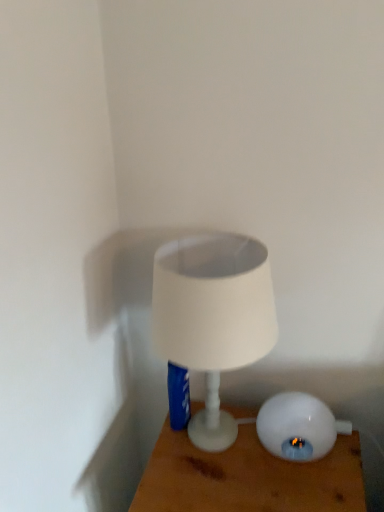
Question: Can you confirm if white matte lampshade at center, acting as the first lamp starting from the left, is taller than white glossy lamp at lower right, the second lamp from the left?

Choices:
 (A) no
 (B) yes

Answer: (B)

Question: Can you confirm if white matte lampshade at center, acting as the first lamp starting from the left, is wider than white glossy lamp at lower right, the first lamp in the right-to-left sequence?

Choices:
 (A) yes
 (B) no

Answer: (A)

Question: Is white matte lampshade at center, acting as the first lamp starting from the left, further to camera compared to white glossy lamp at lower right, the first lamp in the right-to-left sequence?

Choices:
 (A) no
 (B) yes

Answer: (A)

Question: Is white matte lampshade at center, the 2th lamp when ordered from right to left, thinner than white glossy lamp at lower right, the first lamp in the right-to-left sequence?

Choices:
 (A) no
 (B) yes

Answer: (A)

Question: Is white matte lampshade at center, acting as the first lamp starting from the left, looking in the opposite direction of white glossy lamp at lower right, the second lamp from the left?

Choices:
 (A) yes
 (B) no

Answer: (B)

Question: Is white matte lampshade at center, the 2th lamp when ordered from right to left, bigger or smaller than white glossy lamp at lower right, the first lamp in the right-to-left sequence?

Choices:
 (A) small
 (B) big

Answer: (B)

Question: Considering the positions of point (200, 446) and point (261, 436), is point (200, 446) closer or farther from the camera than point (261, 436)?

Choices:
 (A) farther
 (B) closer

Answer: (B)

Question: From a real-world perspective, relative to white glossy lamp at lower right, the first lamp in the right-to-left sequence, is white matte lampshade at center, acting as the first lamp starting from the left, vertically above or below?

Choices:
 (A) above
 (B) below

Answer: (A)

Question: Is white matte lampshade at center, the 2th lamp when ordered from right to left, inside or outside of white glossy lamp at lower right, the first lamp in the right-to-left sequence?

Choices:
 (A) inside
 (B) outside

Answer: (B)

Question: Is white glossy lamp at center to the left or to the right of white matte lampshade at center, acting as the first lamp starting from the left, in the image?

Choices:
 (A) right
 (B) left

Answer: (A)

Question: From the image's perspective, is white glossy lamp at center located above or below white matte lampshade at center, acting as the first lamp starting from the left?

Choices:
 (A) above
 (B) below

Answer: (B)

Question: Looking at the image, does white glossy lamp at center seem bigger or smaller compared to white matte lampshade at center, acting as the first lamp starting from the left?

Choices:
 (A) big
 (B) small

Answer: (A)

Question: Is white glossy lamp at center situated inside white matte lampshade at center, acting as the first lamp starting from the left, or outside?

Choices:
 (A) outside
 (B) inside

Answer: (A)

Question: Choose the correct answer: Is white glossy lamp at lower right, the first lamp in the right-to-left sequence, inside white matte lampshade at center, the 2th lamp when ordered from right to left, or outside it?

Choices:
 (A) inside
 (B) outside

Answer: (B)

Question: In the image, is white glossy lamp at lower right, the first lamp in the right-to-left sequence, positioned in front of or behind white matte lampshade at center, the 2th lamp when ordered from right to left?

Choices:
 (A) behind
 (B) front

Answer: (A)